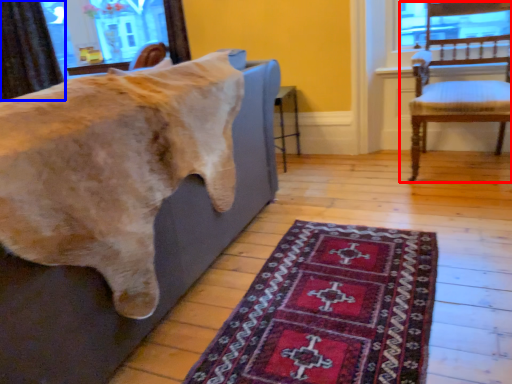
Question: Which point is closer to the camera, chair (highlighted by a red box) or curtain (highlighted by a blue box)?

Choices:
 (A) chair
 (B) curtain

Answer: (A)